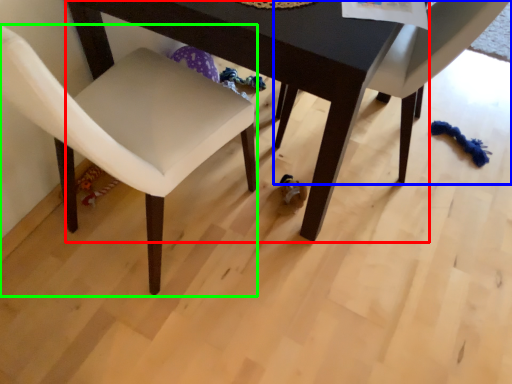
Question: Estimate the real-world distances between objects in this image. Which object is farther from table (highlighted by a red box), chair (highlighted by a blue box) or chair (highlighted by a green box)?

Choices:
 (A) chair
 (B) chair

Answer: (A)